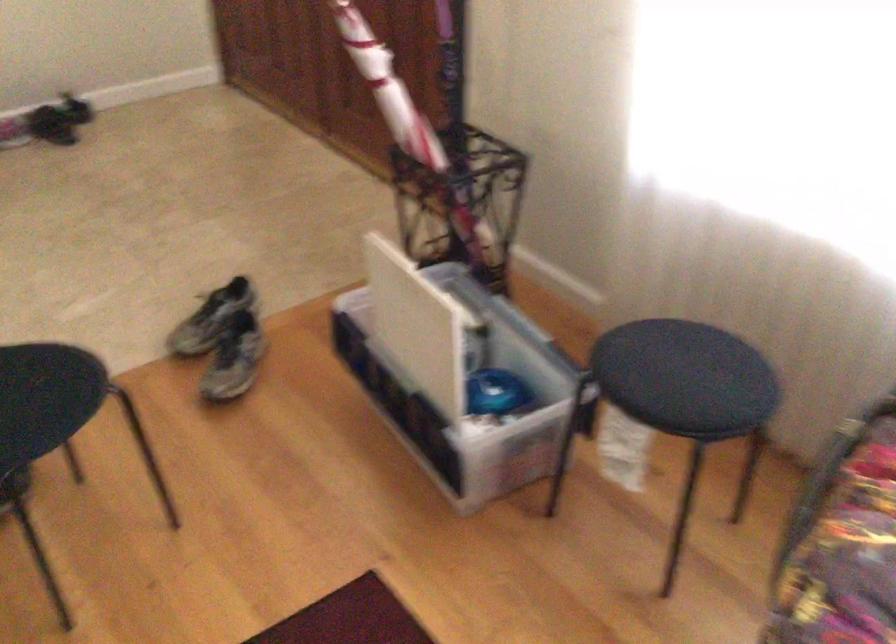
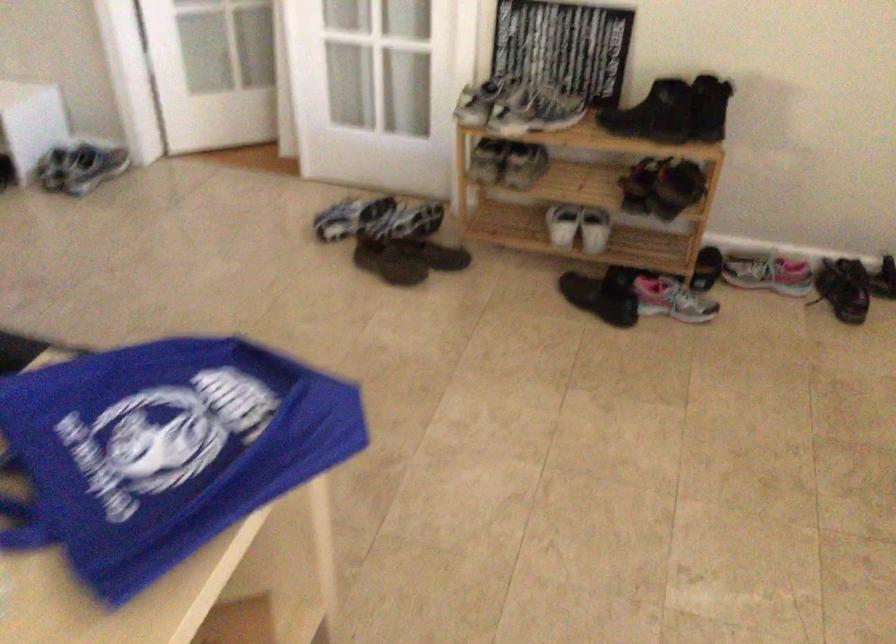
Question: The images are taken continuously from a first-person perspective. In which direction is your viewpoint rotating?

Choices:
 (A) Left
 (B) Right
 (C) Up
 (D) Down

Answer: (A)